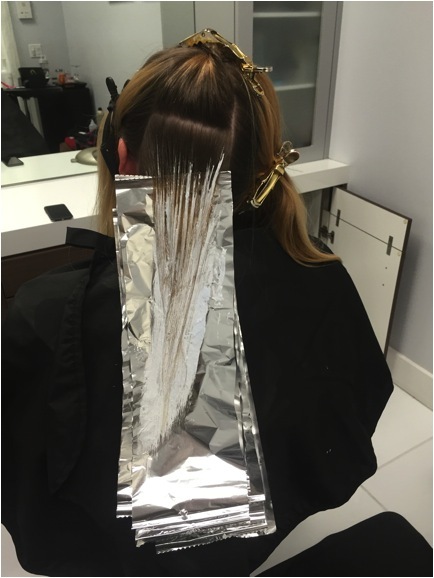
What are the coordinates of `counter` in the screenshot? It's located at (10, 216).